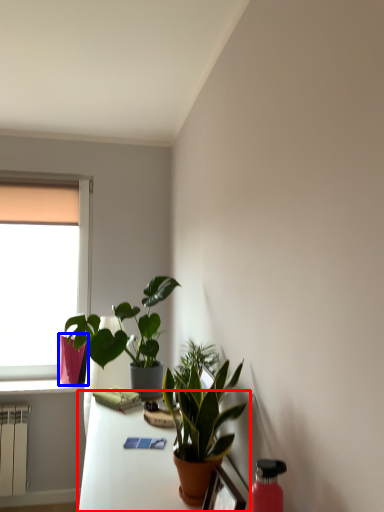
Question: Which of the following is the farthest to the observer, table (highlighted by a red box) or flowerpot (highlighted by a blue box)?

Choices:
 (A) table
 (B) flowerpot

Answer: (B)